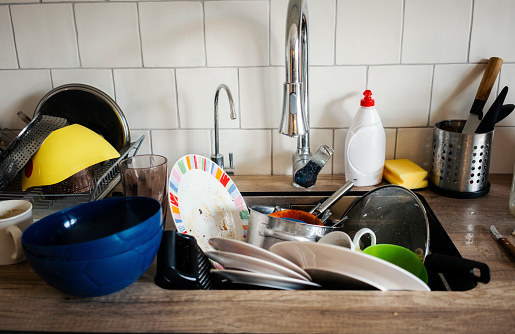
Identify the location of bowls. (406, 255), (76, 241), (94, 272), (80, 134).